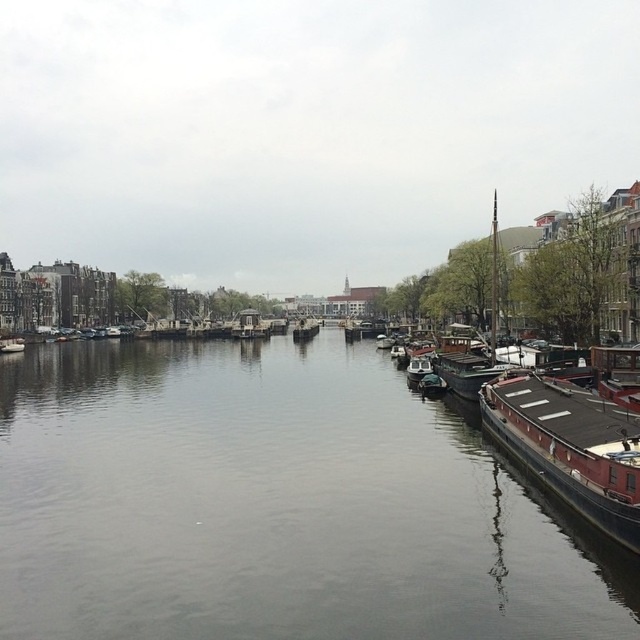
Does point (228, 392) come closer to viewer compared to point (596, 406)?

No.

From the picture: Is smooth water at center taller than brown wooden barge at right?

Indeed, smooth water at center has a greater height compared to brown wooden barge at right.

Which is in front, point (136, 621) or point (570, 492)?

Point (136, 621) is more forward.

This screenshot has height=640, width=640. In order to click on smooth water at center in this screenshot , I will do `click(273, 504)`.